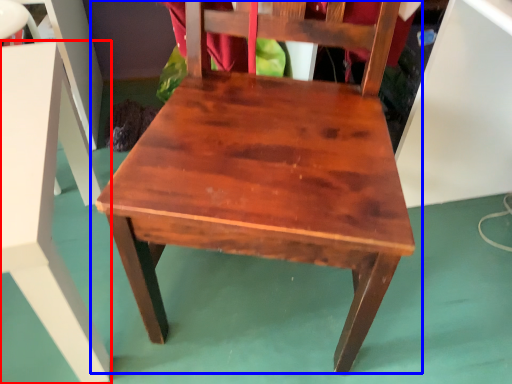
Question: Which of the following is the farthest to the observer, table (highlighted by a red box) or chair (highlighted by a blue box)?

Choices:
 (A) table
 (B) chair

Answer: (A)